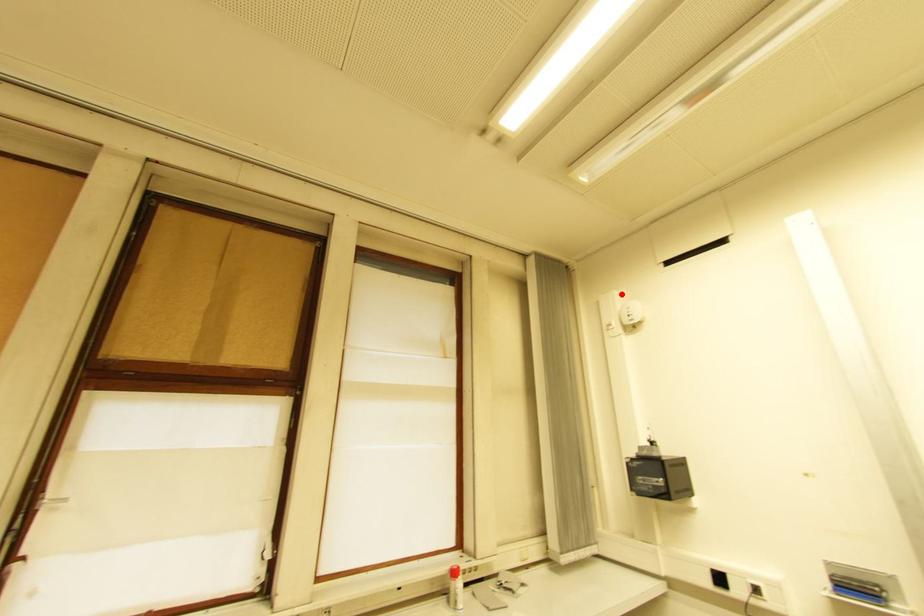
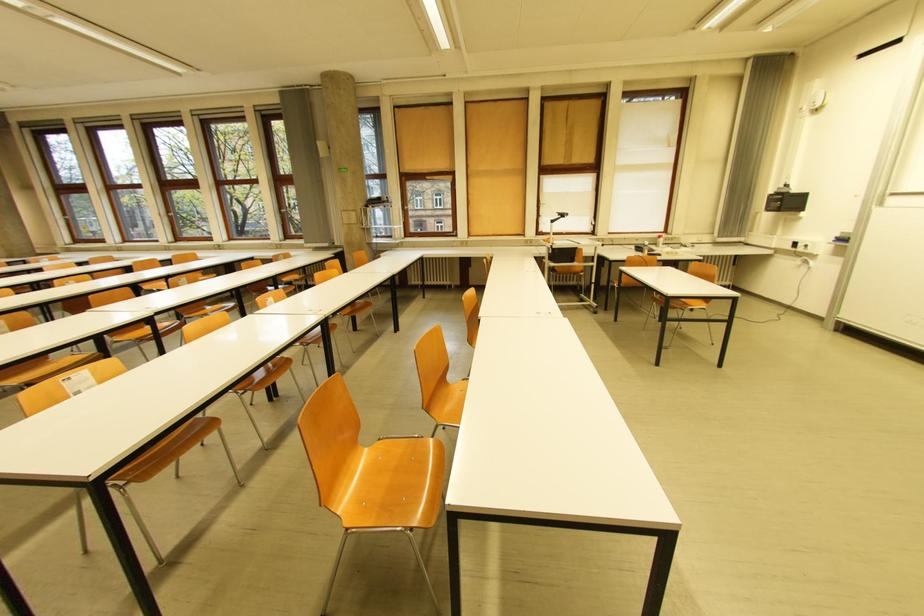
The point at the highlighted location is marked in the first image. Where is the corresponding point in the second image?

(823, 82)